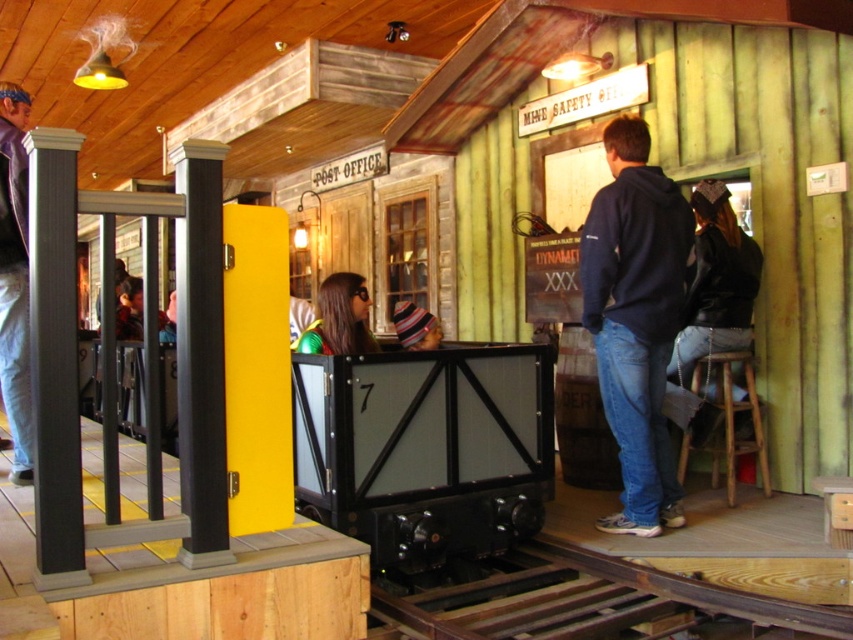
Question: Is purple leather jacket at left to the left of shiny green jacket at center from the viewer's perspective?

Choices:
 (A) yes
 (B) no

Answer: (A)

Question: Is navy blue hoodie at center thinner than purple leather jacket at left?

Choices:
 (A) no
 (B) yes

Answer: (A)

Question: Which is farther from the shiny green jacket at center?

Choices:
 (A) purple leather jacket at left
 (B) striped knit cap at center
 (C) wooden stool at lower right

Answer: (C)

Question: From the image, what is the correct spatial relationship of navy blue hoodie at center in relation to shiny green jacket at center?

Choices:
 (A) left
 (B) right

Answer: (B)

Question: Which point is closer to the camera?

Choices:
 (A) (741, 355)
 (B) (430, 312)
 (C) (630, 502)
 (D) (328, 284)

Answer: (C)

Question: Which point is farther to the camera?

Choices:
 (A) navy blue hoodie at center
 (B) purple leather jacket at left
 (C) wooden stool at lower right

Answer: (C)